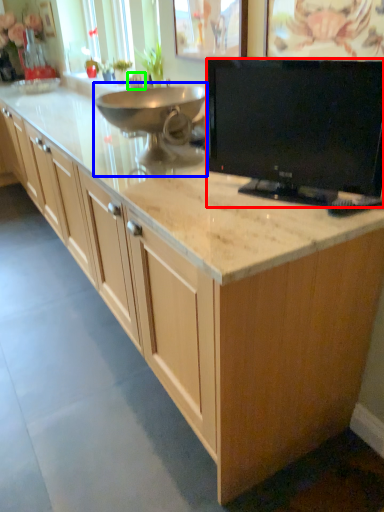
Question: Which object is positioned farthest from television (highlighted by a red box)? Select from appliance (highlighted by a blue box) and faucet (highlighted by a green box).

Choices:
 (A) appliance
 (B) faucet

Answer: (B)